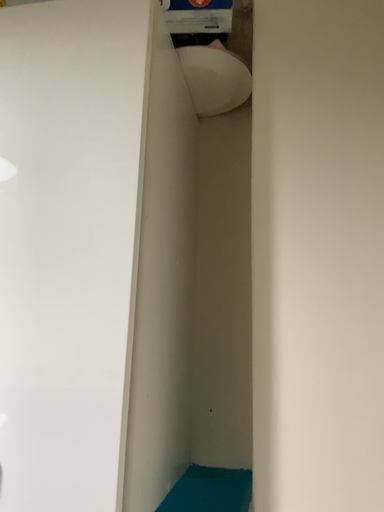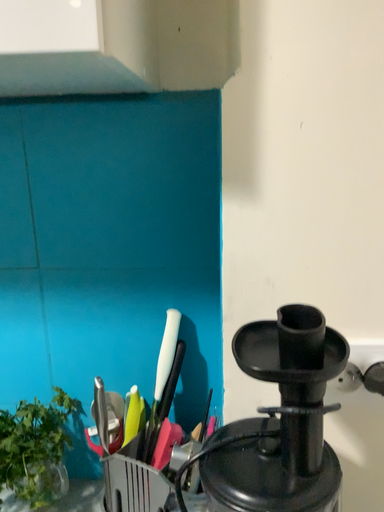
Question: How did the camera likely rotate when shooting the video?

Choices:
 (A) rotated left
 (B) rotated right

Answer: (B)